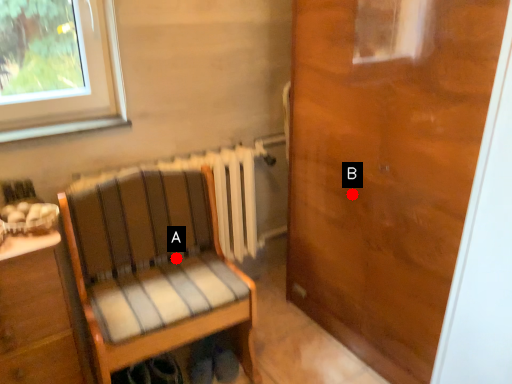
Question: Two points are circled on the image, labeled by A and B beside each circle. Which point is closer to the camera taking this photo?

Choices:
 (A) A is closer
 (B) B is closer

Answer: (B)